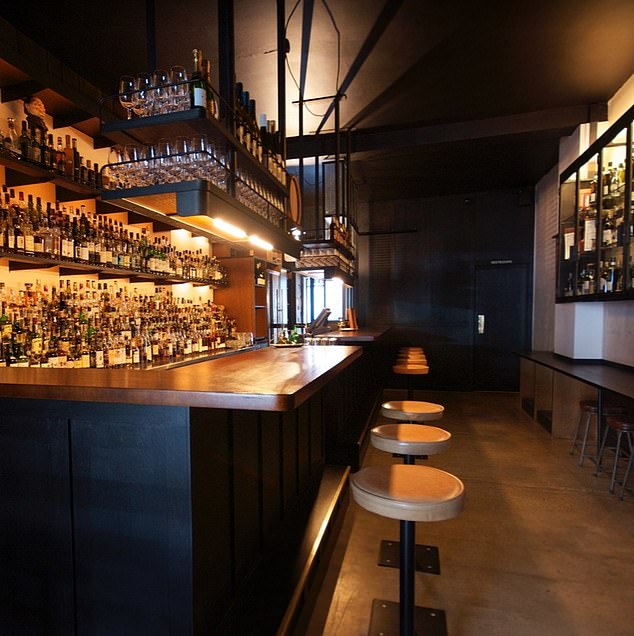
Identify the location of bar. (281, 471), (125, 499).